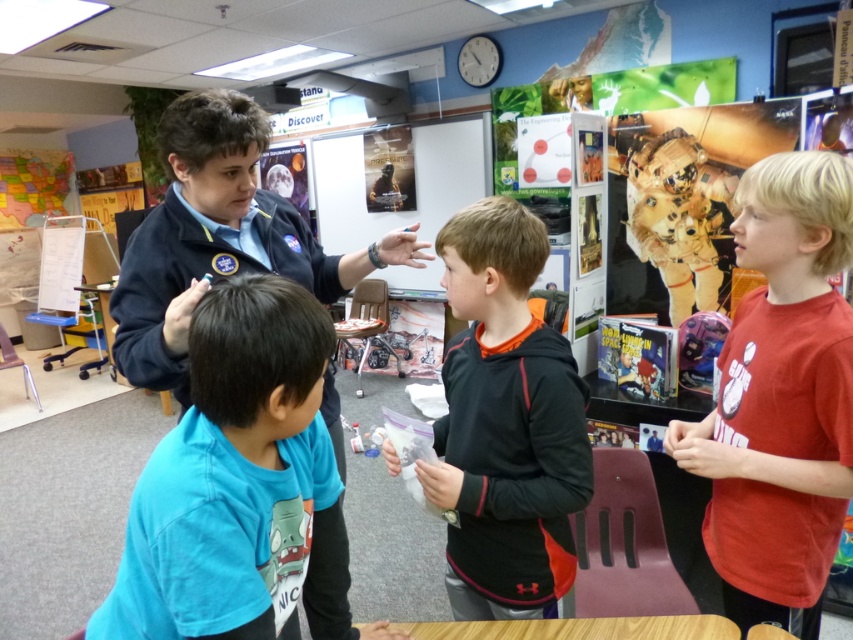
Question: Does blue cotton shirt at center have a larger size compared to black fleece hoodie at center?

Choices:
 (A) no
 (B) yes

Answer: (A)

Question: Where is blue cotton shirt at center located in relation to brown fabric astronaut at upper right in the image?

Choices:
 (A) left
 (B) right

Answer: (A)

Question: Among these points, which one is farthest from the camera?

Choices:
 (A) (718, 305)
 (B) (787, 378)
 (C) (170, 538)
 (D) (463, 548)

Answer: (A)

Question: Can you confirm if blue cotton shirt at center is positioned to the left of black fleece hoodie at center?

Choices:
 (A) no
 (B) yes

Answer: (B)

Question: Which point is closer to the camera?

Choices:
 (A) brown fabric astronaut at upper right
 (B) black fleece hoodie at center
 (C) blue cotton shirt at center

Answer: (C)

Question: Which object is farther from the camera taking this photo?

Choices:
 (A) blue cotton shirt at center
 (B) red cotton shirt at right

Answer: (B)